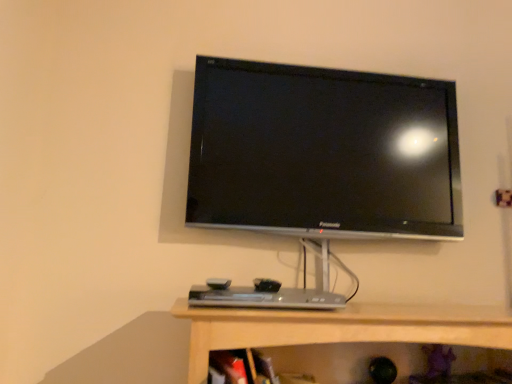
Question: From the image's perspective, is silver metallic desktop at center on top of black glossy tv at upper center?

Choices:
 (A) no
 (B) yes

Answer: (A)

Question: From the image's perspective, would you say silver metallic desktop at center is shown under black glossy tv at upper center?

Choices:
 (A) yes
 (B) no

Answer: (A)

Question: Is silver metallic desktop at center positioned beyond the bounds of black glossy tv at upper center?

Choices:
 (A) no
 (B) yes

Answer: (B)

Question: Is silver metallic desktop at center surrounding black glossy tv at upper center?

Choices:
 (A) no
 (B) yes

Answer: (A)

Question: Can you confirm if silver metallic desktop at center is taller than black glossy tv at upper center?

Choices:
 (A) no
 (B) yes

Answer: (A)

Question: Is silver metallic desktop at center far from black glossy tv at upper center?

Choices:
 (A) yes
 (B) no

Answer: (B)

Question: From the image's perspective, does black glossy tv at upper center appear higher than silver metallic desktop at center?

Choices:
 (A) yes
 (B) no

Answer: (A)

Question: Can you confirm if black glossy tv at upper center is taller than silver metallic desktop at center?

Choices:
 (A) yes
 (B) no

Answer: (A)

Question: Is silver metallic desktop at center inside black glossy tv at upper center?

Choices:
 (A) yes
 (B) no

Answer: (B)

Question: Can you confirm if black glossy tv at upper center is positioned to the right of silver metallic desktop at center?

Choices:
 (A) no
 (B) yes

Answer: (B)

Question: From a real-world perspective, does black glossy tv at upper center sit lower than silver metallic desktop at center?

Choices:
 (A) no
 (B) yes

Answer: (A)

Question: Can you confirm if black glossy tv at upper center is shorter than silver metallic desktop at center?

Choices:
 (A) no
 (B) yes

Answer: (A)

Question: Is silver metallic desktop at center wider or thinner than black glossy tv at upper center?

Choices:
 (A) wide
 (B) thin

Answer: (A)